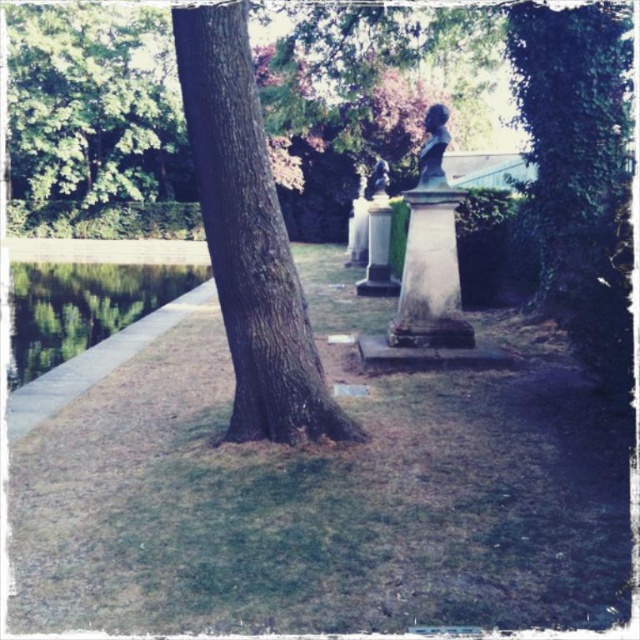
How far apart are brown rough bark tree at center and green leafy tree at upper left?

The distance of brown rough bark tree at center from green leafy tree at upper left is 28.89 meters.

Who is taller, brown rough bark tree at center or green leafy tree at upper left?

Standing taller between the two is brown rough bark tree at center.

Who is more distant from viewer, (276, 387) or (90, 164)?

Positioned behind is point (90, 164).

Where is `brown rough bark tree at center`? brown rough bark tree at center is located at coordinates (250, 237).

Can you confirm if green leafy tree at upper left is positioned above satin bronze bust at upper right?

Yes.

Is green leafy tree at upper left behind satin bronze bust at upper right?

Yes, it is.

The width and height of the screenshot is (640, 640). I want to click on green leafy tree at upper left, so click(92, 100).

Who is lower down, green leafy tree at upper left or green smooth water at lower left?

green smooth water at lower left

Between green leafy tree at upper left and green smooth water at lower left, which one is positioned higher?

Positioned higher is green leafy tree at upper left.

Locate an element on the screen. green leafy tree at upper left is located at coordinates (92, 100).